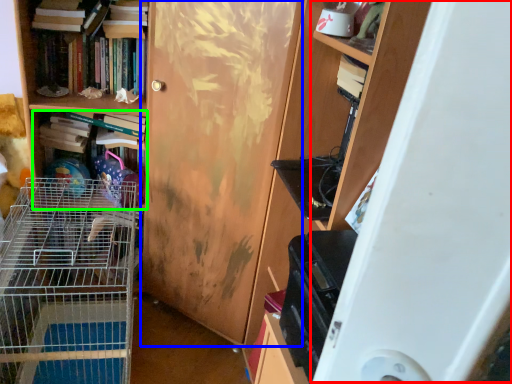
Question: Which is nearer to the wide (highlighted by a red box)? door (highlighted by a blue box) or book (highlighted by a green box).

Choices:
 (A) door
 (B) book

Answer: (A)